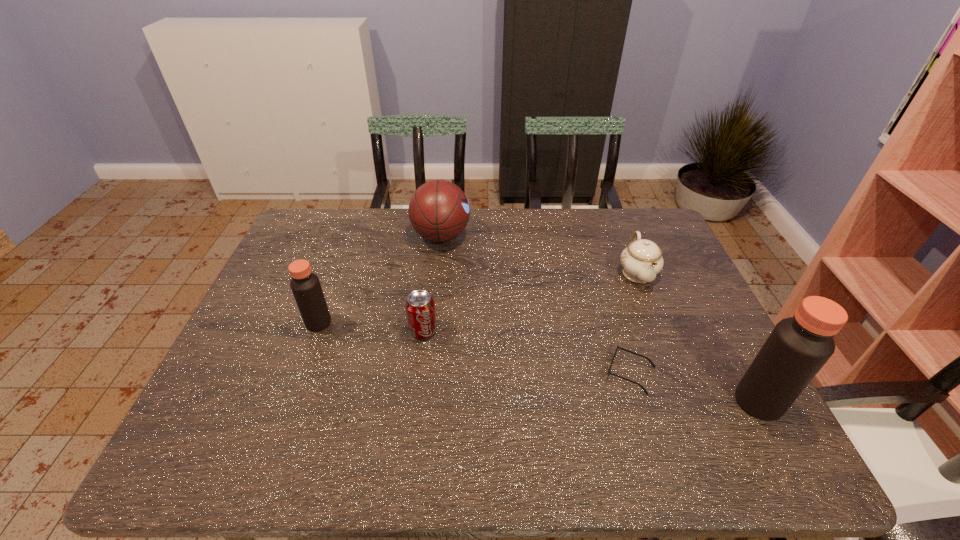
Identify the location of empty space between the soda can and the basketball. The height and width of the screenshot is (540, 960). (432, 283).

This screenshot has height=540, width=960. What are the coordinates of `free spot between the soda can and the chinaware` in the screenshot? It's located at (530, 301).

Identify the location of vacant area that lies between the basketball and the farther vinegar. This screenshot has height=540, width=960. (380, 279).

What are the coordinates of `free spot between the leftmost object and the soda can` in the screenshot? It's located at (371, 327).

Locate an element on the screen. blank region between the taller vinegar and the soda can is located at coordinates (590, 366).

Identify the location of vacant region between the nearer vinegar and the leftmost object. (539, 362).

In order to click on blank region between the basketball and the rightmost object in this screenshot , I will do `click(600, 319)`.

At what (x,y) coordinates should I click in order to perform the action: click on vacant space that's between the shorter vinegar and the shortest object. Please return your answer as a coordinate pair (x, y). This screenshot has height=540, width=960. Looking at the image, I should click on (474, 348).

Where is `free space that is in between the soda can and the leftmost object`? Image resolution: width=960 pixels, height=540 pixels. free space that is in between the soda can and the leftmost object is located at coordinates (371, 327).

Where is `object that stands as the second closest to the chinaware`? object that stands as the second closest to the chinaware is located at coordinates 798,347.